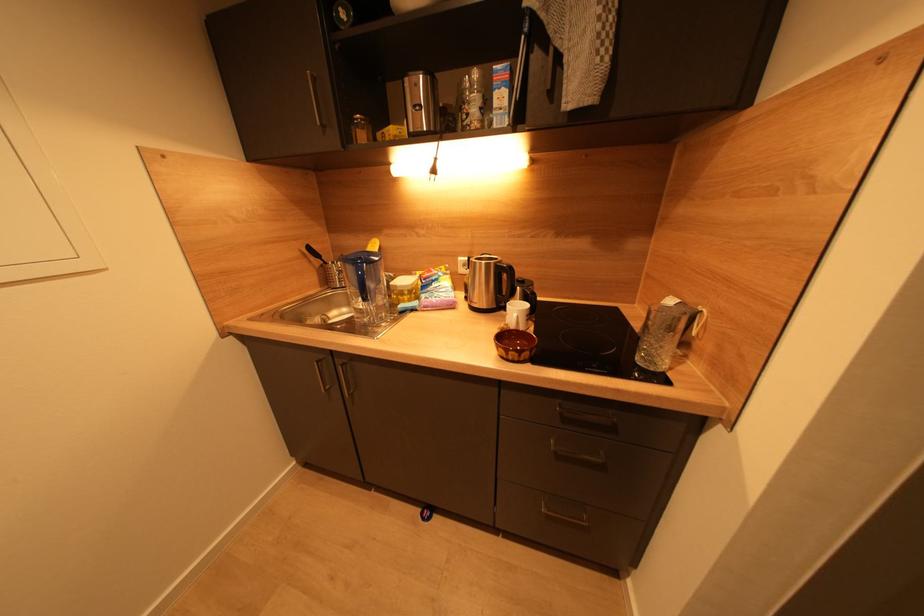
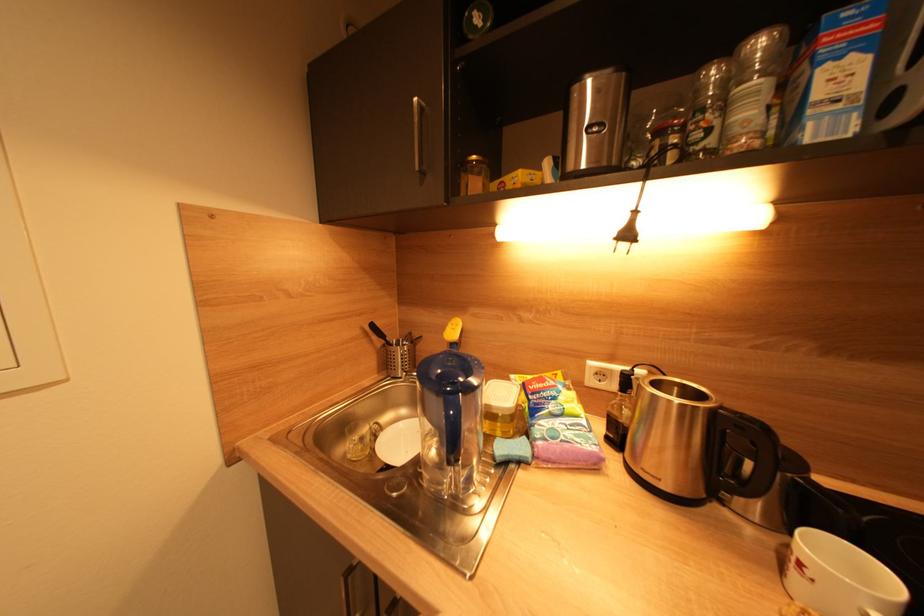
Question: The camera is either moving clockwise (left) or counter-clockwise (right) around the object. The first image is from the beginning of the video and the second image is from the end. Is the camera moving left or right when shooting the video?

Choices:
 (A) Left
 (B) Right

Answer: (B)